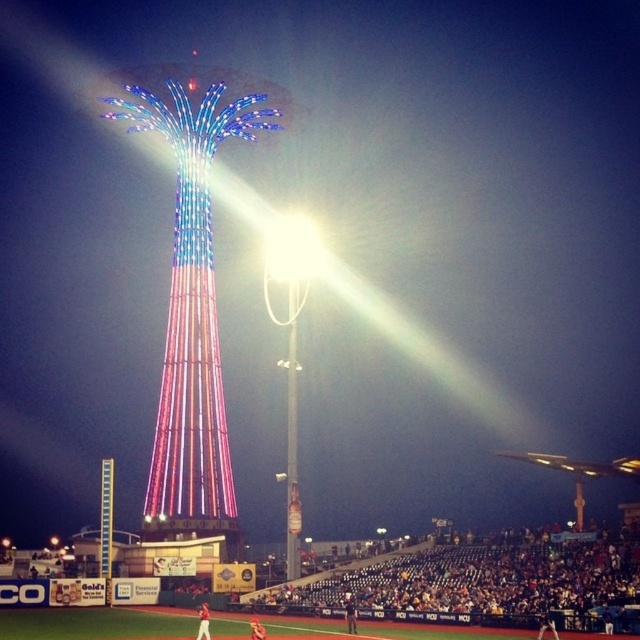
You are a photographer trying to capture the shiny metallic tower at center and the dark blue jersey at lower center in the same frame. Based on their positions, which object should you adjust your camera to focus on first if you want to ensure both are in the shot?

Since the shiny metallic tower at center is to the left of the dark blue jersey at lower center, you should focus on the shiny metallic tower at center first as it is positioned further left and will help frame both objects within the camera view.

From the picture: You are a photographer trying to capture a clear shot of the shiny metallic tower at center and the dark blue jersey at lower center. However, the jersey is partially blocking your view of the tower. Which object should you move to ensure the tower is fully visible?

The dark blue jersey at lower center is behind the shiny metallic tower at center. To ensure the tower is fully visible, you should move the dark blue jersey at lower center out of the way.

You are standing at the center of the baseball stadium and see two points in the image. The first point is at coordinates point (404, 600) and the second is at point (284, 237). Which of these points is closer to you?

Point (404, 600) is in front of point (284, 237), so the first point is closer to you.